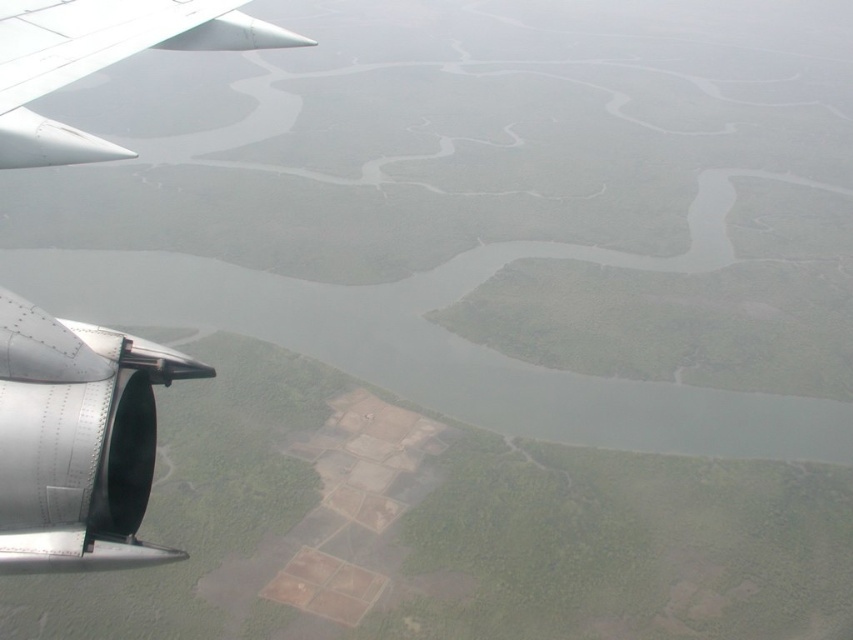
Question: Is metallic silver wing at upper left to the right of white matte wing at upper left from the viewer's perspective?

Choices:
 (A) no
 (B) yes

Answer: (B)

Question: Which point is closer to the camera?

Choices:
 (A) (67, 484)
 (B) (64, 45)

Answer: (A)

Question: Which object appears farthest from the camera in this image?

Choices:
 (A) metallic silver wing at upper left
 (B) white matte wing at upper left

Answer: (B)

Question: Is metallic silver wing at upper left smaller than white matte wing at upper left?

Choices:
 (A) yes
 (B) no

Answer: (A)

Question: In this image, where is metallic silver wing at upper left located relative to white matte wing at upper left?

Choices:
 (A) above
 (B) below

Answer: (B)